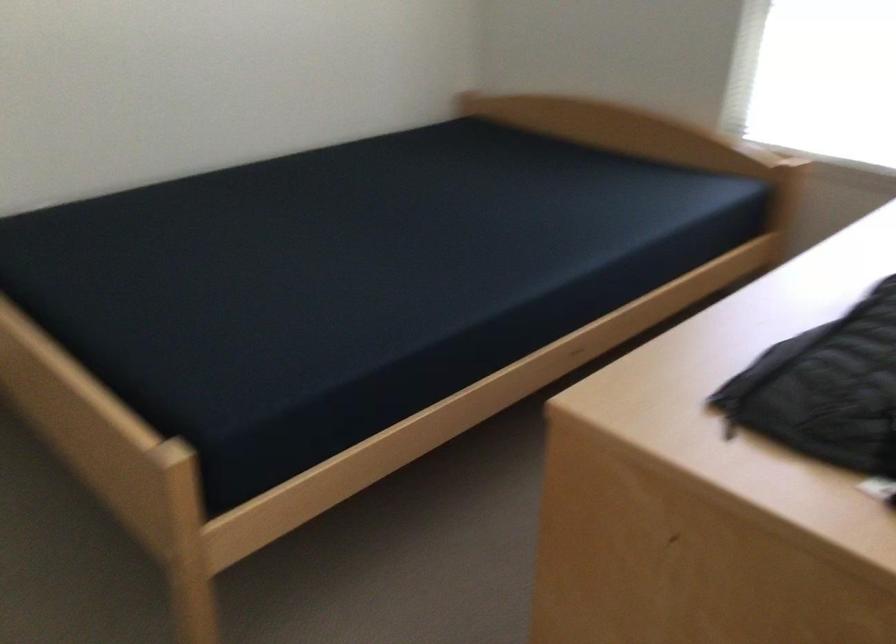
At what (x,y) coordinates should I click in order to perform the action: click on dark bed surface. Please return your answer as a coordinate pair (x, y). The image size is (896, 644). Looking at the image, I should click on (362, 256).